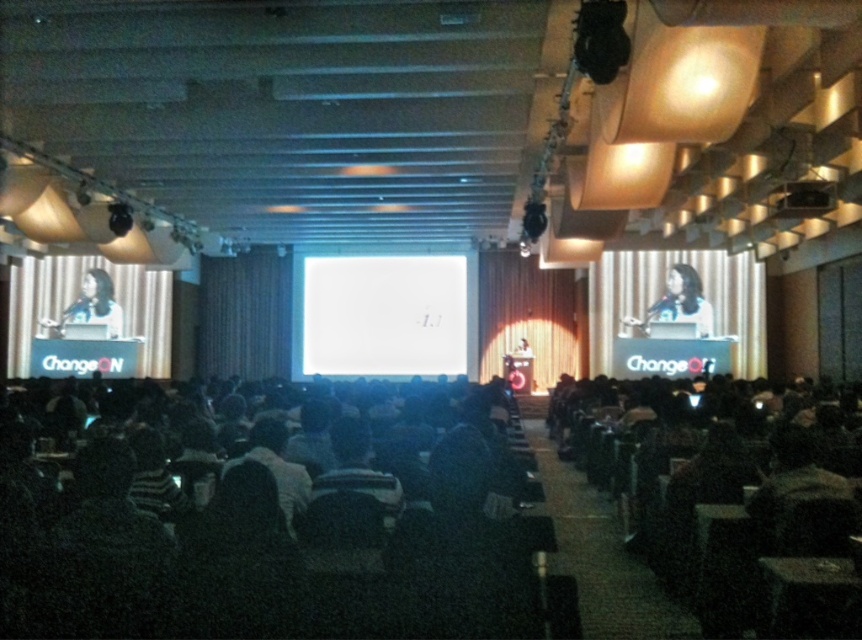
You are attending a conference in the hall and need to locate the matte black laptop at left. Based on its coordinates, where would you find it in the room?

The matte black laptop at left is located at coordinates point [91,307], which places it near the center of the left side wall in the room.

You are an attendee at the conference and you need to borrow a laptop. Both the matte black laptop at right and the matte black laptop at left are available. However, you notice that one is placed over the other. Which laptop should you choose to avoid disturbing the setup?

The matte black laptop at left should be chosen because the matte black laptop at right is positioned over it, so removing the one underneath might disrupt the setup.